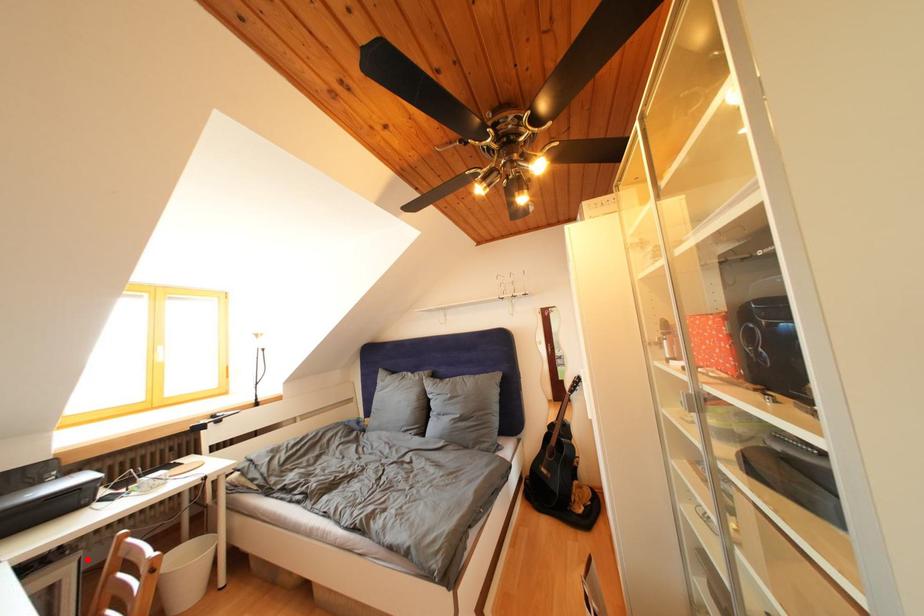
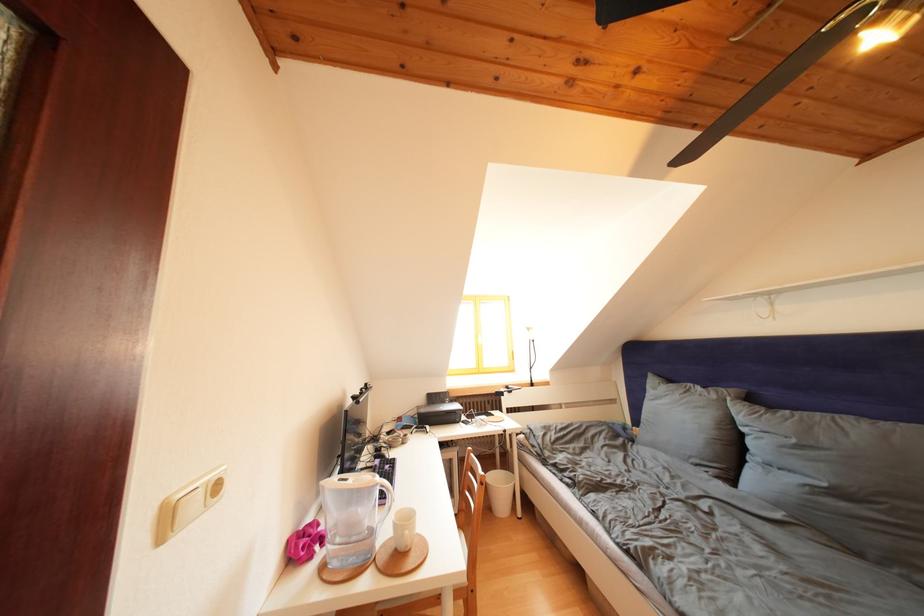
Locate, in the second image, the point that corresponds to the highlighted location in the first image.

(466, 454)